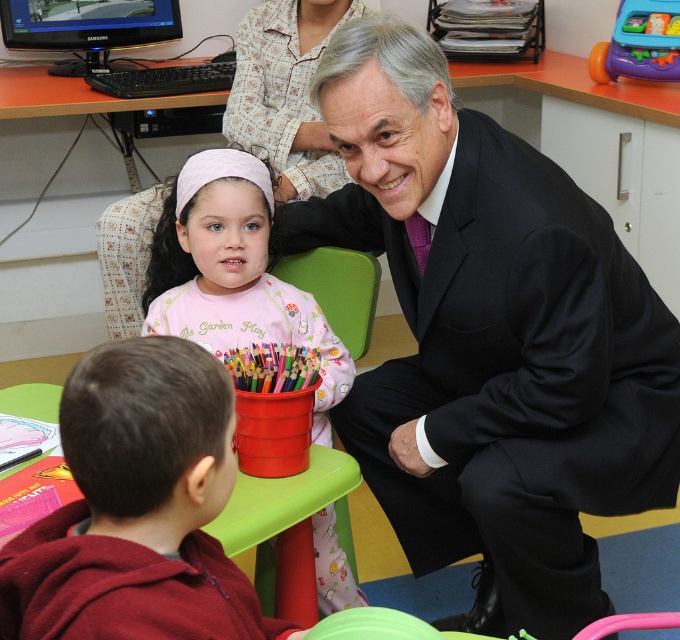
Question: Which point is closer to the camera?

Choices:
 (A) black glossy monitor at upper left
 (B) black suit at center

Answer: (B)

Question: Which point is closer to the camera taking this photo?

Choices:
 (A) (320, 376)
 (B) (88, 397)
 (C) (409, 243)
 (D) (31, 42)

Answer: (B)

Question: Is black suit at center bigger than pink fabric dress at center?

Choices:
 (A) no
 (B) yes

Answer: (B)

Question: Which object appears closest to the camera in this image?

Choices:
 (A) black glossy monitor at upper left
 (B) black suit at center
 (C) green plastic chair at center

Answer: (B)

Question: Is black suit at center wider than maroon fleece hoodie at lower left?

Choices:
 (A) yes
 (B) no

Answer: (A)

Question: Does black suit at center have a greater width compared to pink fabric dress at center?

Choices:
 (A) no
 (B) yes

Answer: (B)